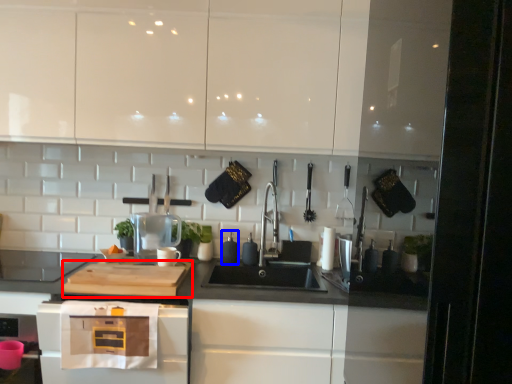
Question: Which of the following is the closest to the observer, cutting board (highlighted by a red box) or appliance (highlighted by a blue box)?

Choices:
 (A) cutting board
 (B) appliance

Answer: (A)